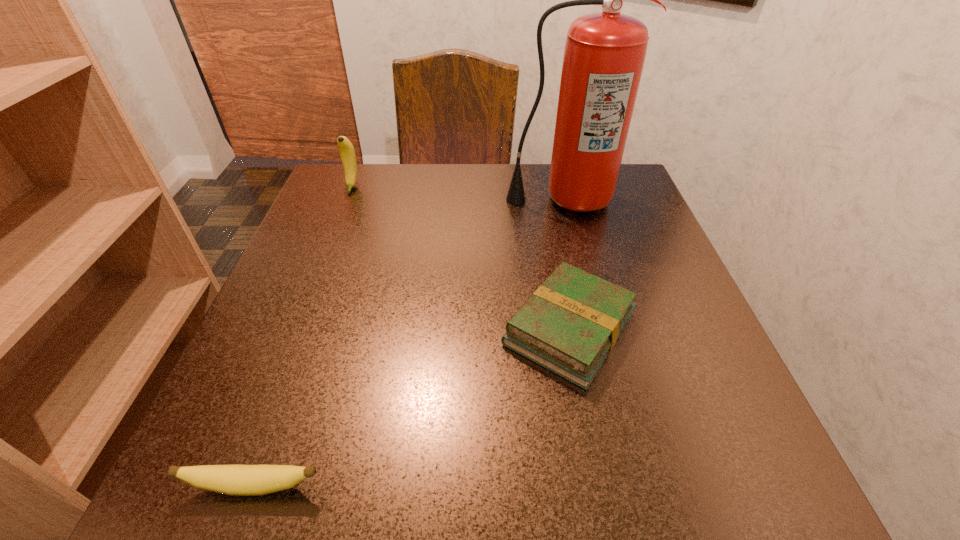
In the image, there is a desktop. Where is `vacant area at the left edge`? This screenshot has height=540, width=960. vacant area at the left edge is located at coordinates (373, 256).

Image resolution: width=960 pixels, height=540 pixels. What are the coordinates of `free region at the right edge of the desktop` in the screenshot? It's located at (652, 325).

In the image, there is a desktop. Identify the location of vacant space at the far left corner. (339, 187).

Find the location of a particular element. The image size is (960, 540). free space at the far right corner of the desktop is located at coordinates (627, 179).

You are a GUI agent. You are given a task and a screenshot of the screen. Output one action in this format:
    pyautogui.click(x=<x>, y=<y>)
    Task: Click on the vacant area that lies between the taller banana and the shorter banana
    The height and width of the screenshot is (540, 960).
    Given the screenshot: What is the action you would take?
    pyautogui.click(x=303, y=336)

I want to click on free point between the third farthest object and the taller banana, so click(x=461, y=258).

This screenshot has height=540, width=960. I want to click on empty space that is in between the book and the farther banana, so click(x=461, y=258).

This screenshot has width=960, height=540. What are the coordinates of `vacant point located between the taller banana and the book` in the screenshot? It's located at (461, 258).

This screenshot has height=540, width=960. In order to click on vacant area between the nearest object and the book in this screenshot , I will do `click(412, 407)`.

Image resolution: width=960 pixels, height=540 pixels. Identify the location of free space between the nearest object and the second tallest object. (303, 336).